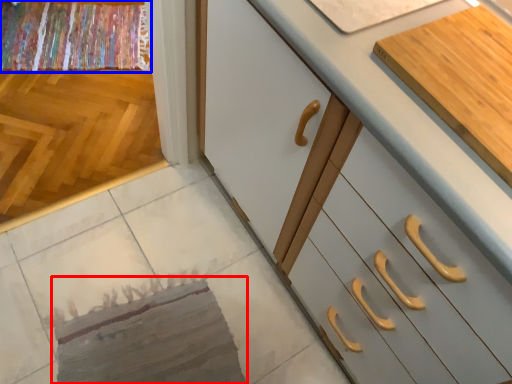
Question: Which point is closer to the camera, mat (highlighted by a red box) or blanket (highlighted by a blue box)?

Choices:
 (A) mat
 (B) blanket

Answer: (A)